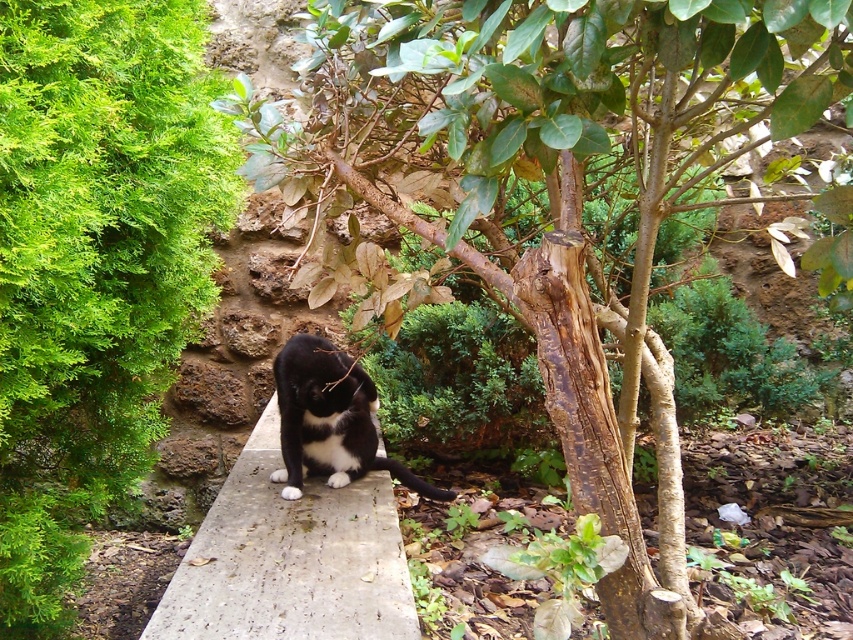
Can you confirm if concrete at center is taller than black fur cat at center?

No, concrete at center is not taller than black fur cat at center.

What do you see at coordinates (289, 560) in the screenshot? I see `concrete at center` at bounding box center [289, 560].

Describe the element at coordinates (289, 560) in the screenshot. I see `concrete at center` at that location.

Locate an element on the screen. The image size is (853, 640). concrete at center is located at coordinates (289, 560).

Measure the distance from green leafy bush at left to concrete at center.

The distance of green leafy bush at left from concrete at center is 27.74 inches.

Is green leafy bush at left above concrete at center?

Yes, green leafy bush at left is above concrete at center.

Is point (132, 339) more distant than point (193, 536)?

No, it is in front of (193, 536).

Where is `green leafy bush at left`? green leafy bush at left is located at coordinates (96, 266).

Can you confirm if green leafy bush at left is positioned above black fur cat at center?

Yes, green leafy bush at left is above black fur cat at center.

Is green leafy bush at left positioned in front of black fur cat at center?

Yes, it is in front of black fur cat at center.

What do you see at coordinates (96, 266) in the screenshot? I see `green leafy bush at left` at bounding box center [96, 266].

Where is `green leafy bush at left`? The height and width of the screenshot is (640, 853). green leafy bush at left is located at coordinates tap(96, 266).